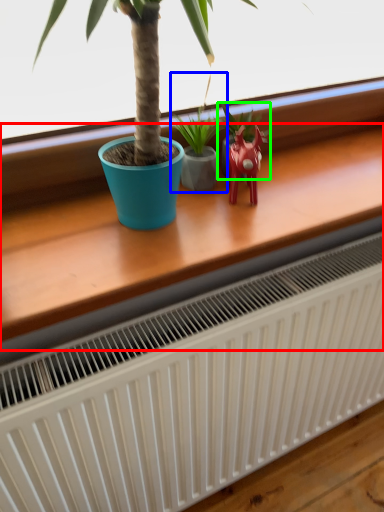
Question: Considering the real-world distances, which object is closest to table (highlighted by a red box)? houseplant (highlighted by a blue box) or houseplant (highlighted by a green box).

Choices:
 (A) houseplant
 (B) houseplant

Answer: (A)